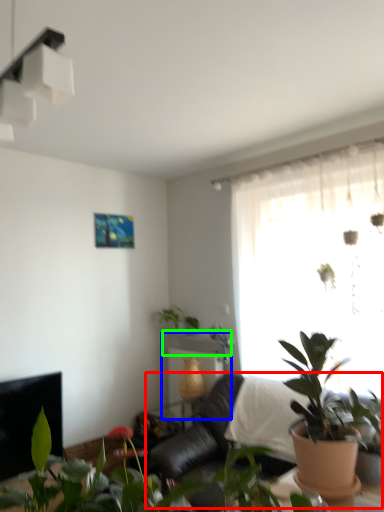
Question: Which object is positioned closest to couch (highlighted by a red box)? Select from table (highlighted by a blue box) and window sill (highlighted by a green box).

Choices:
 (A) table
 (B) window sill

Answer: (A)